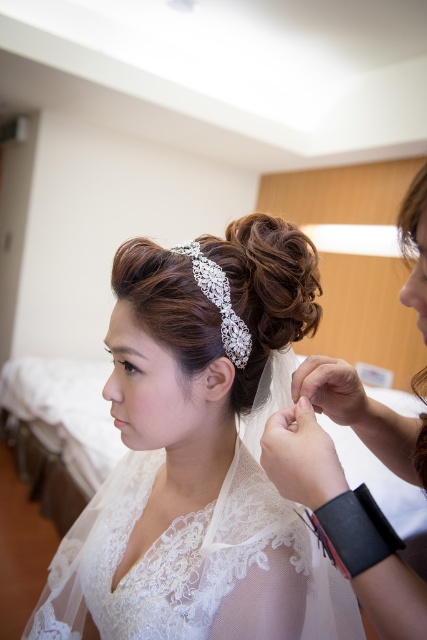
Between white lace veil at upper center and satin white veil at upper center, which one is positioned higher?

satin white veil at upper center

The width and height of the screenshot is (427, 640). Identify the location of white lace veil at upper center. (198, 458).

Between white lace veil at upper center and lace fabric wedding dress at center, which one has less height?

With less height is lace fabric wedding dress at center.

Is point (294, 618) positioned behind point (84, 509)?

No, (294, 618) is in front of (84, 509).

Who is more forward, (248, 225) or (93, 604)?

Point (93, 604) is more forward.

Image resolution: width=427 pixels, height=640 pixels. I want to click on white lace veil at upper center, so click(x=198, y=458).

Who is higher up, satin white veil at upper center or clear crystal headband at center?

clear crystal headband at center

Based on the photo, does satin white veil at upper center have a lesser height compared to clear crystal headband at center?

No.

Measure the distance between satin white veil at upper center and camera.

35.57 centimeters

You are a GUI agent. You are given a task and a screenshot of the screen. Output one action in this format:
    pyautogui.click(x=<x>, y=<y>)
    Task: Click on the satin white veil at upper center
    The image size is (427, 640).
    Given the screenshot: What is the action you would take?
    [x=328, y=436]